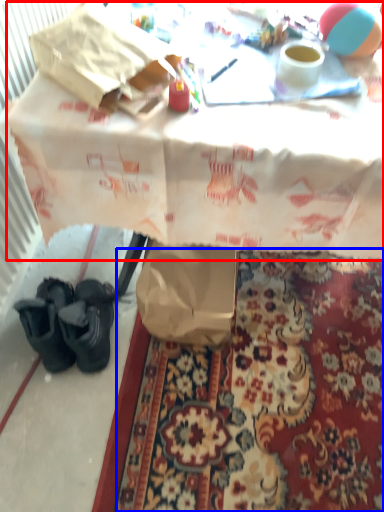
Question: Which object is further to the camera taking this photo, table (highlighted by a red box) or mat (highlighted by a blue box)?

Choices:
 (A) table
 (B) mat

Answer: (B)